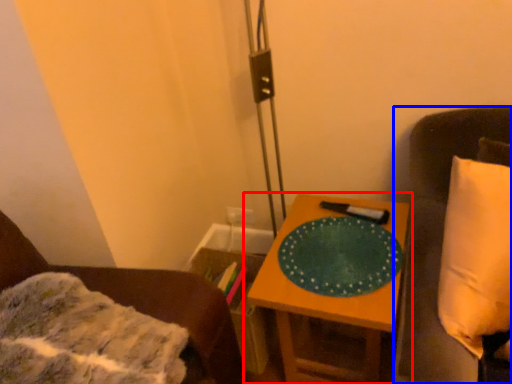
Question: Which object is closer to the camera taking this photo, table (highlighted by a red box) or furniture (highlighted by a blue box)?

Choices:
 (A) table
 (B) furniture

Answer: (B)